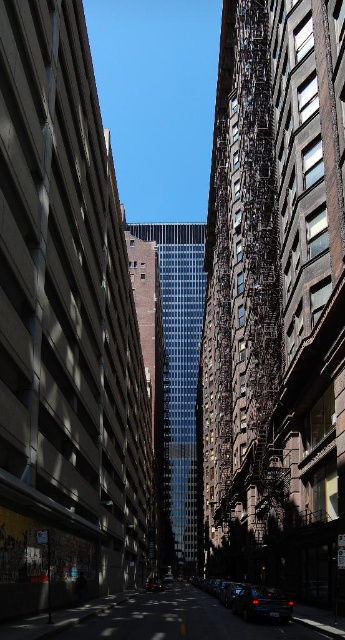
Question: Which point is closer to the camera?

Choices:
 (A) (156, 589)
 (B) (255, 600)
 (C) (240, 595)

Answer: (B)

Question: Does glossy black car at center appear on the right side of shiny black sedan at center?

Choices:
 (A) no
 (B) yes

Answer: (B)

Question: Can you confirm if glossy black car at center is bigger than shiny black sedan at center?

Choices:
 (A) yes
 (B) no

Answer: (B)

Question: Which object appears farthest from the camera in this image?

Choices:
 (A) glossy black car at center
 (B) shiny black sedan at center
 (C) shiny black car at lower center

Answer: (B)

Question: Is shiny black car at lower center positioned before glossy black car at center?

Choices:
 (A) yes
 (B) no

Answer: (B)

Question: Which object appears closest to the camera in this image?

Choices:
 (A) glossy black car at center
 (B) shiny black sedan at center
 (C) shiny black car at lower center

Answer: (A)